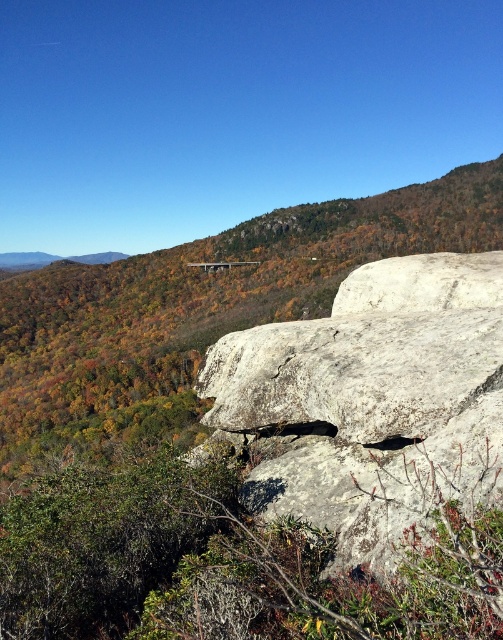
Between gray rough rock at center and gray rough boulder at center, which one is positioned higher?

Positioned higher is gray rough boulder at center.

Can you confirm if gray rough rock at center is wider than gray rough boulder at center?

Yes, gray rough rock at center is wider than gray rough boulder at center.

Between point (209, 364) and point (379, 332), which one is positioned in front?

Point (379, 332) is more forward.

In order to click on gray rough rock at center in this screenshot , I will do `click(374, 400)`.